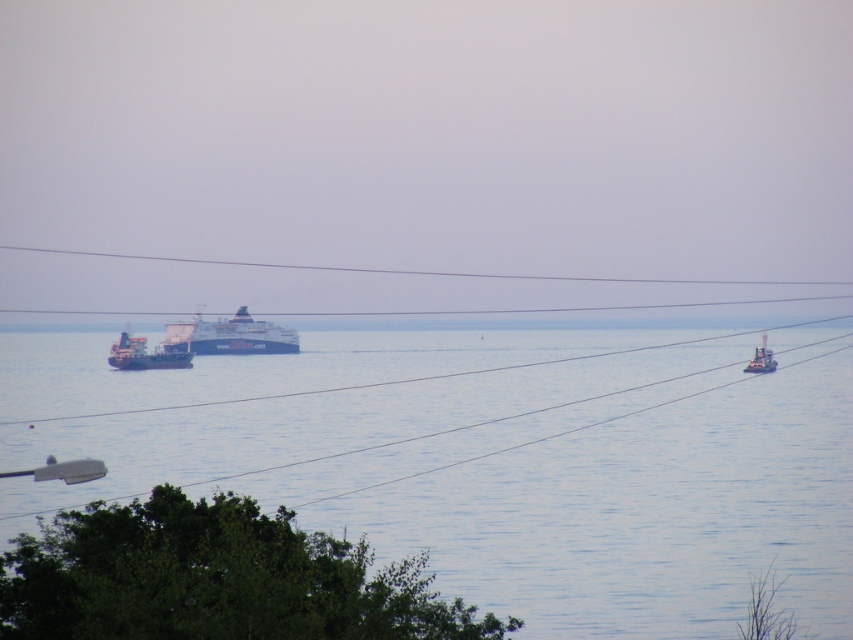
Is point (776, 516) positioned in front of point (764, 365)?

That is True.

Can you confirm if blue water at center is positioned below metallic gray boat at right?

Yes, blue water at center is below metallic gray boat at right.

Where is `blue water at center`? This screenshot has width=853, height=640. blue water at center is located at coordinates (537, 481).

Is point (187, 332) closer to viewer compared to point (763, 358)?

No, (187, 332) is further to viewer.

Does blue metallic ship at center have a greater width compared to metallic gray boat at right?

Indeed, blue metallic ship at center has a greater width compared to metallic gray boat at right.

Between point (247, 339) and point (753, 369), which one is positioned behind?

Point (247, 339)

The image size is (853, 640). Identify the location of blue metallic ship at center. (229, 336).

Which is below, green matte cargo ship at center or metallic gray boat at right?

metallic gray boat at right is lower down.

Does point (173, 358) lie behind point (750, 365)?

Yes, it is behind point (750, 365).

This screenshot has width=853, height=640. In order to click on green matte cargo ship at center in this screenshot , I will do `click(144, 355)`.